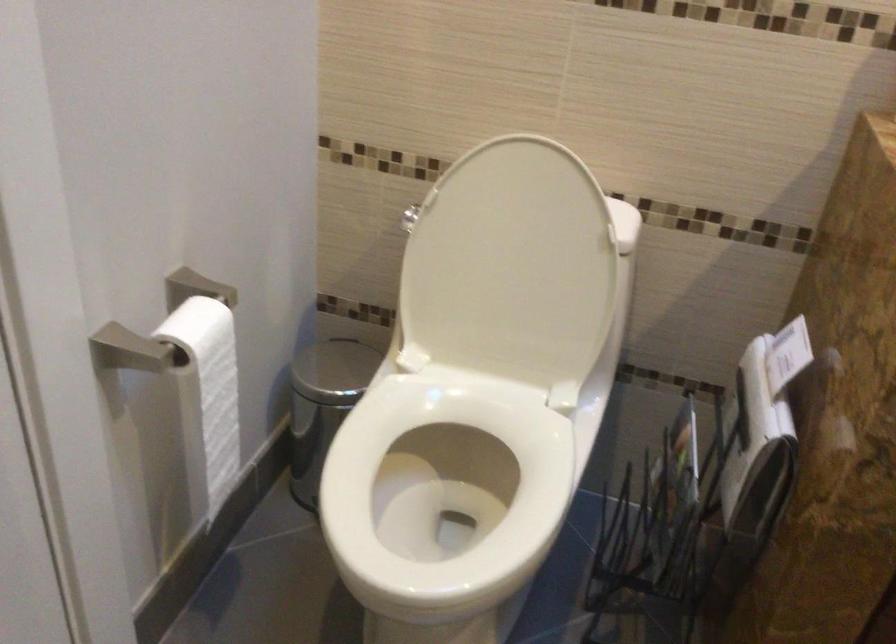
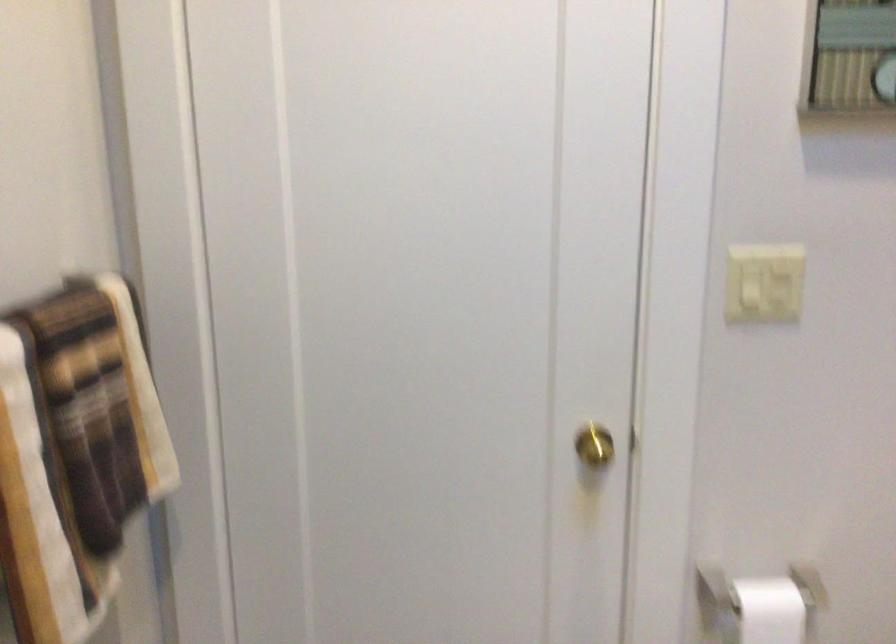
Question: The camera is either moving clockwise (left) or counter-clockwise (right) around the object. The first image is from the beginning of the video and the second image is from the end. Is the camera moving left or right when shooting the video?

Choices:
 (A) Left
 (B) Right

Answer: (B)